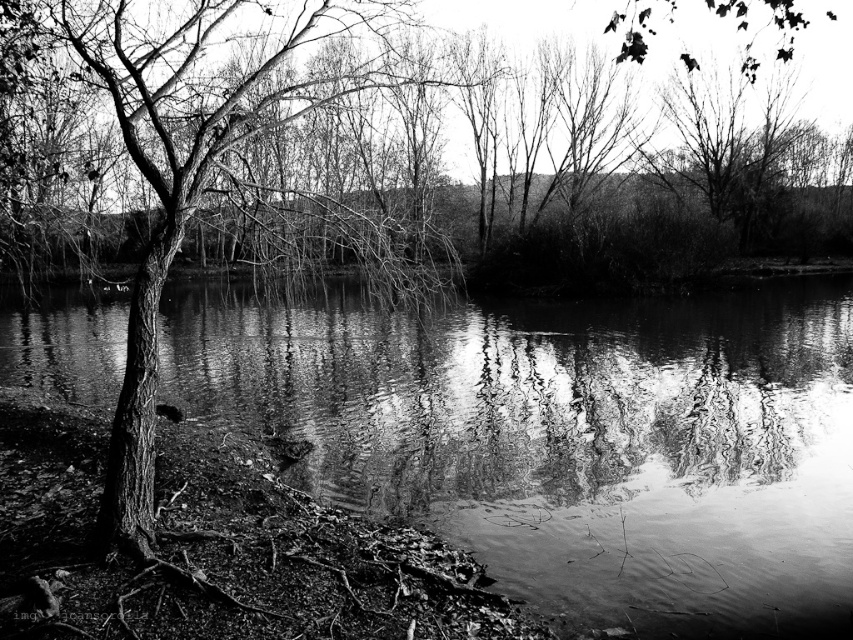
Question: Does smooth water at center appear on the right side of smooth bark tree at left?

Choices:
 (A) no
 (B) yes

Answer: (B)

Question: Can you confirm if smooth water at center is thinner than smooth bark tree at left?

Choices:
 (A) no
 (B) yes

Answer: (A)

Question: Is smooth water at center further to the viewer compared to smooth bark tree at left?

Choices:
 (A) yes
 (B) no

Answer: (A)

Question: Which point is closer to the camera taking this photo?

Choices:
 (A) (132, 547)
 (B) (695, 588)

Answer: (A)

Question: Among these objects, which one is nearest to the camera?

Choices:
 (A) smooth bark tree at left
 (B) smooth water at center

Answer: (A)